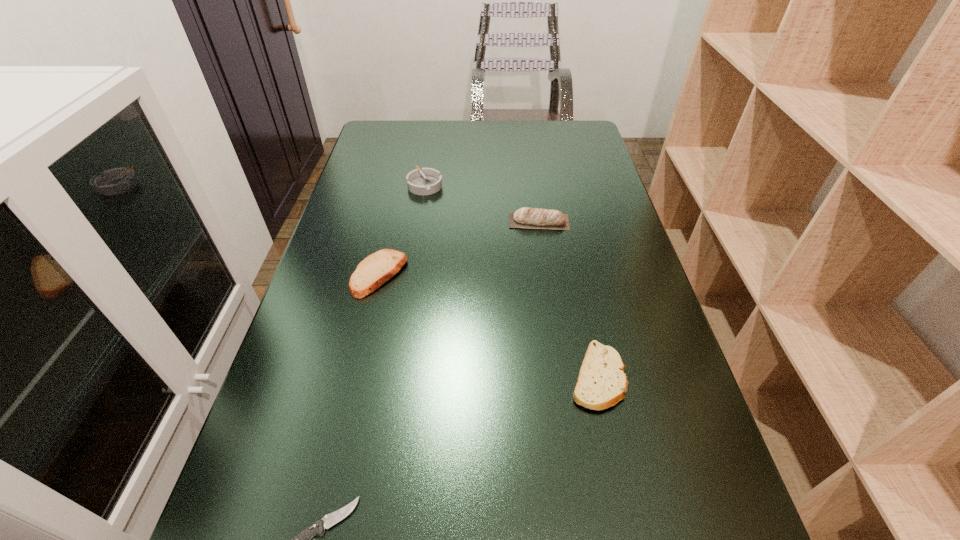
You are a GUI agent. You are given a task and a screenshot of the screen. Output one action in this format:
    pyautogui.click(x=<x>, y=<y>)
    Task: Click on the vacant region located on the back of the fourth farthest object
    The width and height of the screenshot is (960, 540).
    Given the screenshot: What is the action you would take?
    pyautogui.click(x=575, y=271)

The height and width of the screenshot is (540, 960). I want to click on object that is at the left edge, so click(x=376, y=269).

The height and width of the screenshot is (540, 960). In the image, there is a desktop. In order to click on vacant space at the far edge in this screenshot , I will do `click(433, 152)`.

The width and height of the screenshot is (960, 540). I want to click on free space at the left edge of the desktop, so click(356, 252).

The height and width of the screenshot is (540, 960). Identify the location of vacant space at the right edge of the desktop. (575, 222).

In the image, there is a desktop. Where is `free region at the far right corner`? The width and height of the screenshot is (960, 540). free region at the far right corner is located at coordinates (574, 141).

Identify the location of free space between the third nearest object and the nearest pita bread. (489, 326).

Where is `unoccupied position between the second farthest pita bread and the ashtray`? The image size is (960, 540). unoccupied position between the second farthest pita bread and the ashtray is located at coordinates (402, 230).

I want to click on vacant space that is in between the second nearest pita bread and the farthest pita bread, so click(x=459, y=248).

This screenshot has height=540, width=960. I want to click on vacant region between the ashtray and the third farthest object, so click(x=402, y=230).